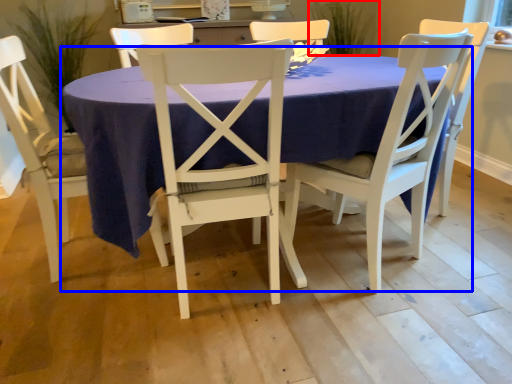
Question: Which object appears closest to the camera in this image, plant (highlighted by a red box) or kitchen & dining room table (highlighted by a blue box)?

Choices:
 (A) plant
 (B) kitchen & dining room table

Answer: (B)